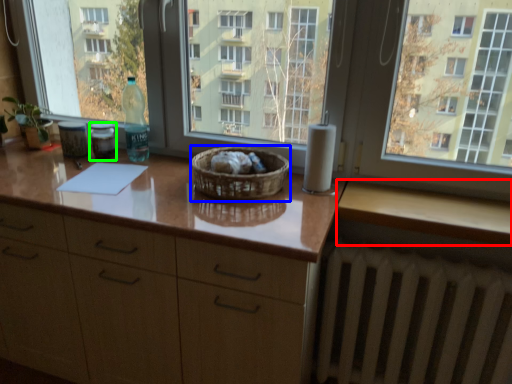
Question: Which object is the farthest from counter top (highlighted by a red box)? Choose among these: basket (highlighted by a blue box) or bottle (highlighted by a green box).

Choices:
 (A) basket
 (B) bottle

Answer: (B)